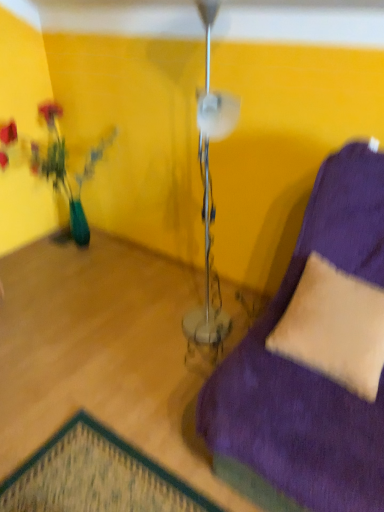
Where is `vacant space in front of teal glass vase at left`? The height and width of the screenshot is (512, 384). vacant space in front of teal glass vase at left is located at coordinates (64, 301).